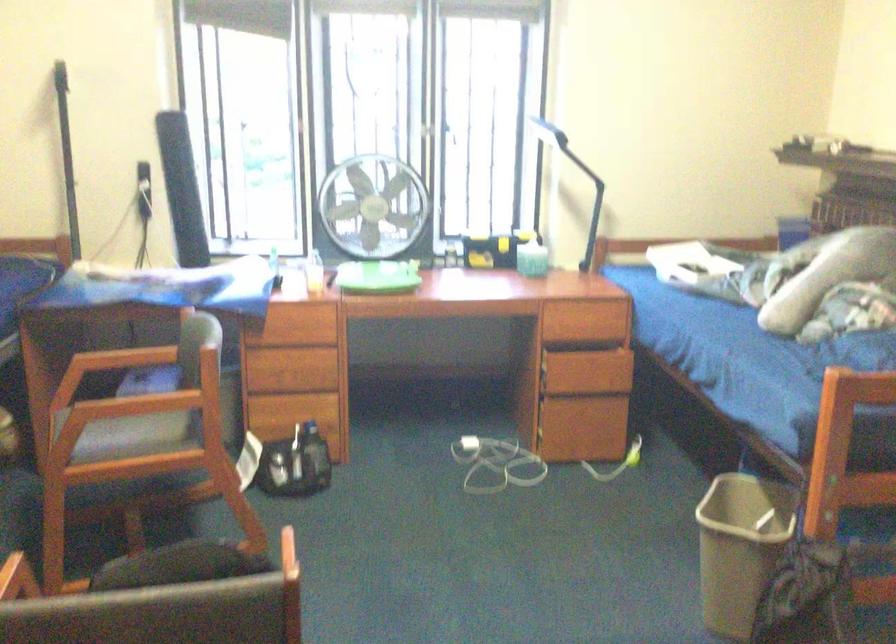
This screenshot has height=644, width=896. What are the coordinates of `beige trash can` in the screenshot? It's located at (741, 547).